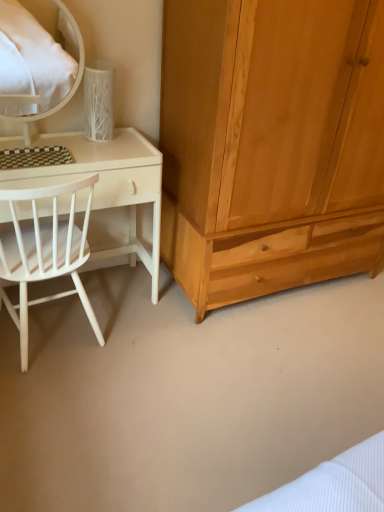
Question: Is white matte desk at left bigger than white wood chair at left?

Choices:
 (A) yes
 (B) no

Answer: (A)

Question: Would you say white matte desk at left is a long distance from white wood chair at left?

Choices:
 (A) yes
 (B) no

Answer: (B)

Question: Can you confirm if white matte desk at left is thinner than white wood chair at left?

Choices:
 (A) yes
 (B) no

Answer: (A)

Question: From the image's perspective, is white matte desk at left on white wood chair at left?

Choices:
 (A) yes
 (B) no

Answer: (A)

Question: Does white matte desk at left have a smaller size compared to white wood chair at left?

Choices:
 (A) no
 (B) yes

Answer: (A)

Question: From the image's perspective, is natural wood wardrobe at right positioned above or below white matte desk at left?

Choices:
 (A) above
 (B) below

Answer: (A)

Question: Relative to white matte desk at left, is natural wood wardrobe at right in front or behind?

Choices:
 (A) front
 (B) behind

Answer: (A)

Question: Does point (180, 108) appear closer or farther from the camera than point (157, 217)?

Choices:
 (A) farther
 (B) closer

Answer: (B)

Question: Is natural wood wardrobe at right inside or outside of white matte desk at left?

Choices:
 (A) inside
 (B) outside

Answer: (B)

Question: Considering the positions of point (62, 233) and point (18, 71), is point (62, 233) closer or farther from the camera than point (18, 71)?

Choices:
 (A) farther
 (B) closer

Answer: (B)

Question: Is white wood chair at left taller or shorter than white glossy mirror at upper left?

Choices:
 (A) tall
 (B) short

Answer: (A)

Question: Is white wood chair at left in front of or behind white glossy mirror at upper left in the image?

Choices:
 (A) front
 (B) behind

Answer: (A)

Question: From a real-world perspective, relative to white glossy mirror at upper left, is white wood chair at left vertically above or below?

Choices:
 (A) below
 (B) above

Answer: (A)

Question: In terms of width, does natural wood wardrobe at right look wider or thinner when compared to white wood chair at left?

Choices:
 (A) thin
 (B) wide

Answer: (B)

Question: From their relative heights in the image, would you say natural wood wardrobe at right is taller or shorter than white wood chair at left?

Choices:
 (A) short
 (B) tall

Answer: (B)